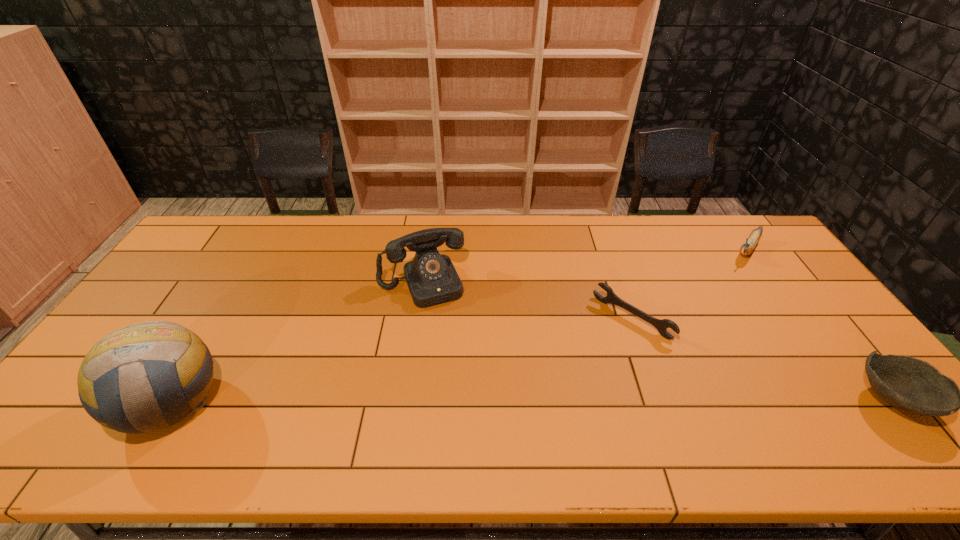
At what (x,y) coordinates should I click in order to perform the action: click on volleyball at the near edge. Please return your answer as a coordinate pair (x, y). The height and width of the screenshot is (540, 960). Looking at the image, I should click on (118, 378).

You are a GUI agent. You are given a task and a screenshot of the screen. Output one action in this format:
    pyautogui.click(x=<x>, y=<y>)
    Task: Click on the bowl that is at the near edge
    
    Given the screenshot: What is the action you would take?
    pyautogui.click(x=912, y=385)

Where is `object that is at the left edge`? object that is at the left edge is located at coordinates (118, 378).

This screenshot has width=960, height=540. Identify the location of bowl that is at the right edge. coord(912,385).

This screenshot has height=540, width=960. Find the location of `banana situated at the right edge`. banana situated at the right edge is located at coordinates (749, 245).

Locate an element on the screen. This screenshot has width=960, height=540. object located in the near left corner section of the desktop is located at coordinates (118, 378).

This screenshot has height=540, width=960. Find the location of `object positioned at the far right corner`. object positioned at the far right corner is located at coordinates (749, 245).

Identify the location of object located at the near right corner. The image size is (960, 540). (912, 385).

The width and height of the screenshot is (960, 540). What are the coordinates of `vacant space at the far edge of the desktop` in the screenshot? It's located at (414, 224).

This screenshot has height=540, width=960. Find the location of `blank space at the near edge of the desktop`. blank space at the near edge of the desktop is located at coordinates (388, 414).